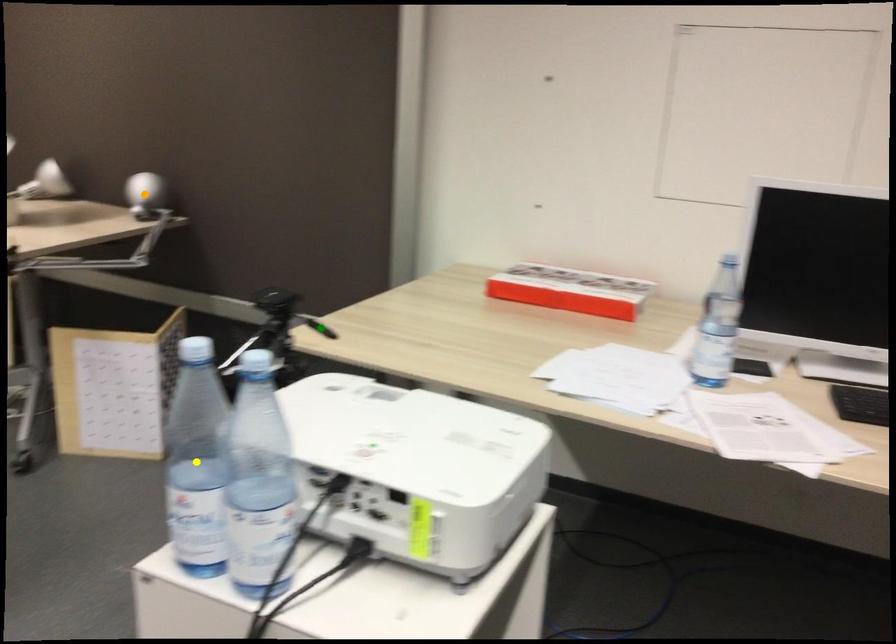
Order these from nearest to farthest:
yellow point, orange point, green point

yellow point
green point
orange point